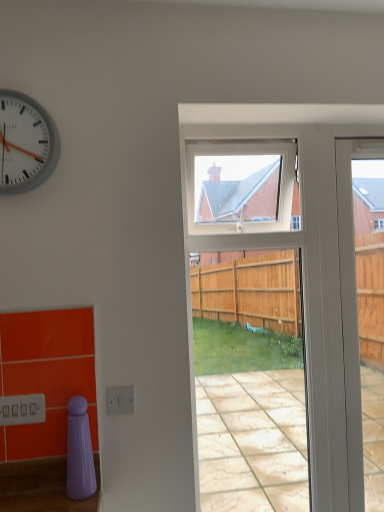
Question: Is white plastic clock at upper left next to white glossy door at right?

Choices:
 (A) no
 (B) yes

Answer: (A)

Question: Considering the relative sizes of white plastic clock at upper left and white glossy door at right in the image provided, is white plastic clock at upper left thinner than white glossy door at right?

Choices:
 (A) yes
 (B) no

Answer: (B)

Question: Would you say white plastic clock at upper left is a long distance from white glossy door at right?

Choices:
 (A) no
 (B) yes

Answer: (B)

Question: Does white plastic clock at upper left turn towards white glossy door at right?

Choices:
 (A) no
 (B) yes

Answer: (A)

Question: From a real-world perspective, is white plastic clock at upper left located beneath white glossy door at right?

Choices:
 (A) no
 (B) yes

Answer: (A)

Question: Does white plastic clock at upper left have a greater height compared to white glossy door at right?

Choices:
 (A) no
 (B) yes

Answer: (A)

Question: Is white plastic clock at upper left thinner than clear glass screen door at center?

Choices:
 (A) yes
 (B) no

Answer: (A)

Question: Is white plastic clock at upper left surrounding clear glass screen door at center?

Choices:
 (A) yes
 (B) no

Answer: (B)

Question: Does white plastic clock at upper left touch clear glass screen door at center?

Choices:
 (A) yes
 (B) no

Answer: (B)

Question: From a real-world perspective, is white plastic clock at upper left located beneath clear glass screen door at center?

Choices:
 (A) yes
 (B) no

Answer: (B)

Question: Is white plastic clock at upper left closer to camera compared to clear glass screen door at center?

Choices:
 (A) no
 (B) yes

Answer: (B)

Question: Is white plastic clock at upper left bigger than clear glass screen door at center?

Choices:
 (A) no
 (B) yes

Answer: (A)

Question: Is clear glass screen door at center placed right next to white plastic clock at upper left?

Choices:
 (A) yes
 (B) no

Answer: (B)